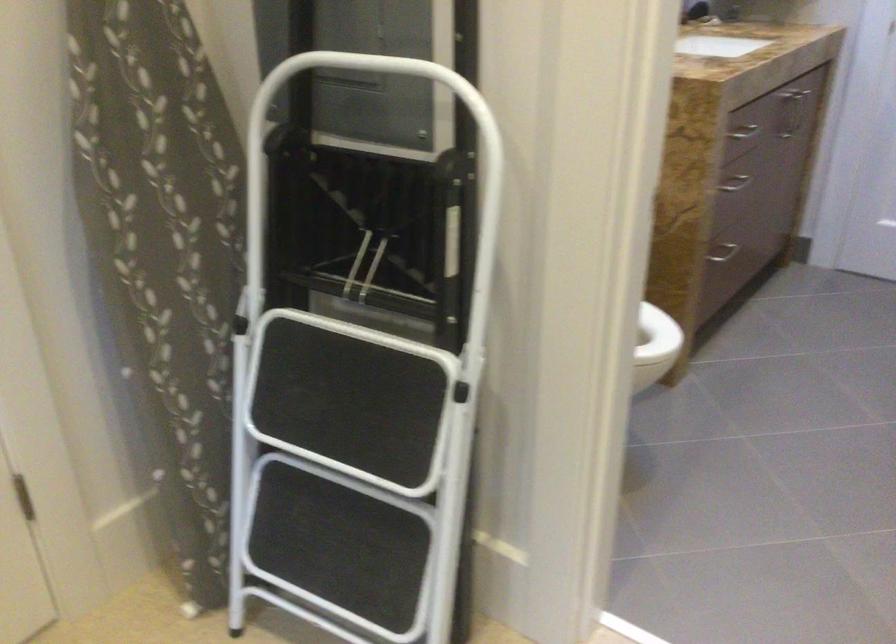
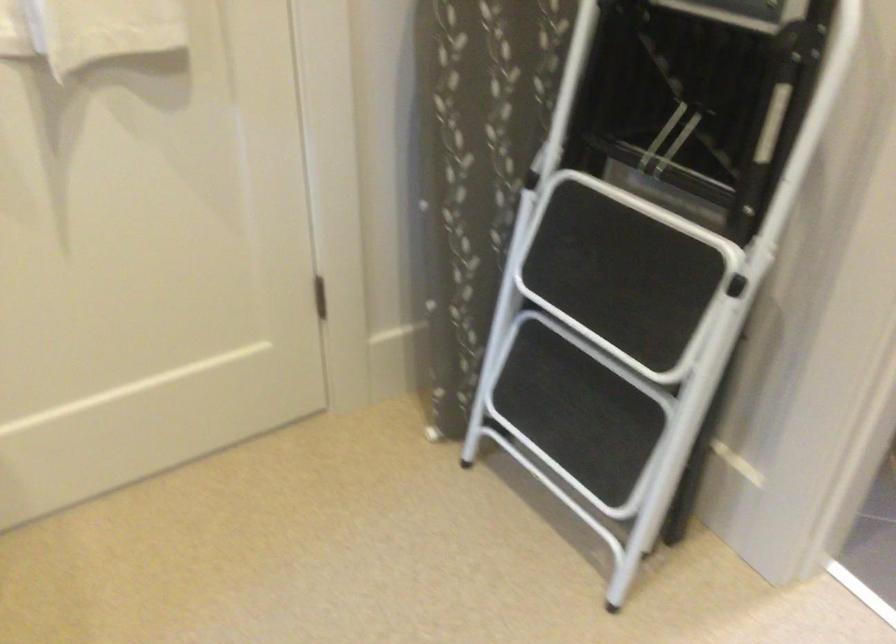
In the second image, find the point that corresponds to the point at 355,474 in the first image.

(607, 342)